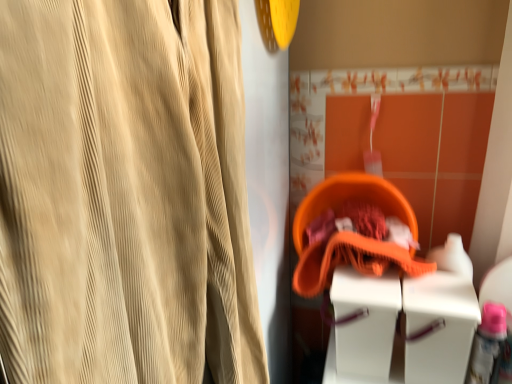
Question: Does beige corduroy curtain at left have a larger size compared to orange fabric basket at center?

Choices:
 (A) no
 (B) yes

Answer: (B)

Question: From the image's perspective, is beige corduroy curtain at left above orange fabric basket at center?

Choices:
 (A) no
 (B) yes

Answer: (A)

Question: Can you see beige corduroy curtain at left touching orange fabric basket at center?

Choices:
 (A) no
 (B) yes

Answer: (A)

Question: Can you confirm if beige corduroy curtain at left is positioned to the left of orange fabric basket at center?

Choices:
 (A) yes
 (B) no

Answer: (A)

Question: Considering the relative sizes of beige corduroy curtain at left and orange fabric basket at center in the image provided, is beige corduroy curtain at left taller than orange fabric basket at center?

Choices:
 (A) yes
 (B) no

Answer: (A)

Question: In terms of size, does orange fabric basket at center appear bigger or smaller than beige corduroy curtain at left?

Choices:
 (A) small
 (B) big

Answer: (A)

Question: Is orange fabric basket at center in front of or behind beige corduroy curtain at left in the image?

Choices:
 (A) front
 (B) behind

Answer: (B)

Question: From the image's perspective, is orange fabric basket at center positioned above or below beige corduroy curtain at left?

Choices:
 (A) above
 (B) below

Answer: (A)

Question: Considering the relative positions of orange fabric basket at center and beige corduroy curtain at left in the image provided, is orange fabric basket at center to the left or to the right of beige corduroy curtain at left?

Choices:
 (A) left
 (B) right

Answer: (B)

Question: From the image's perspective, relative to white plastic vanity at lower right, is orange fabric basket at center above or below?

Choices:
 (A) below
 (B) above

Answer: (B)

Question: From their relative heights in the image, would you say orange fabric basket at center is taller or shorter than white plastic vanity at lower right?

Choices:
 (A) tall
 (B) short

Answer: (A)

Question: Relative to white plastic vanity at lower right, is orange fabric basket at center in front or behind?

Choices:
 (A) behind
 (B) front

Answer: (A)

Question: Is point (309, 271) positioned closer to the camera than point (415, 380)?

Choices:
 (A) farther
 (B) closer

Answer: (A)

Question: From their relative heights in the image, would you say beige corduroy curtain at left is taller or shorter than white plastic vanity at lower right?

Choices:
 (A) tall
 (B) short

Answer: (A)

Question: Looking at their shapes, would you say beige corduroy curtain at left is wider or thinner than white plastic vanity at lower right?

Choices:
 (A) wide
 (B) thin

Answer: (A)